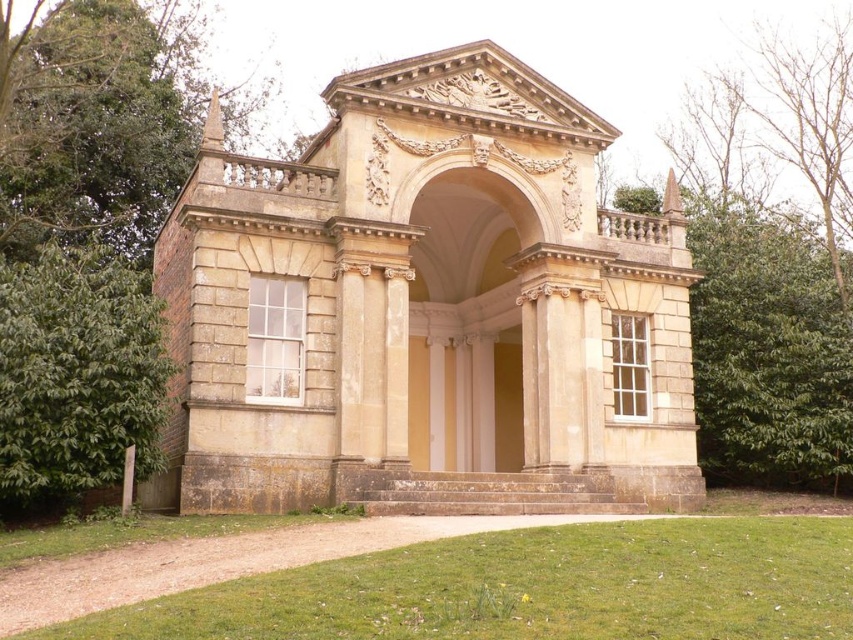
You are standing in front of the classical pavilion and notice two green leafy trees. Which one is more to the left, the green leafy tree at upper left or the green leafy tree at left?

The green leafy tree at upper left is positioned on the left side of green leafy tree at left, so the green leafy tree at upper left is more to the left.